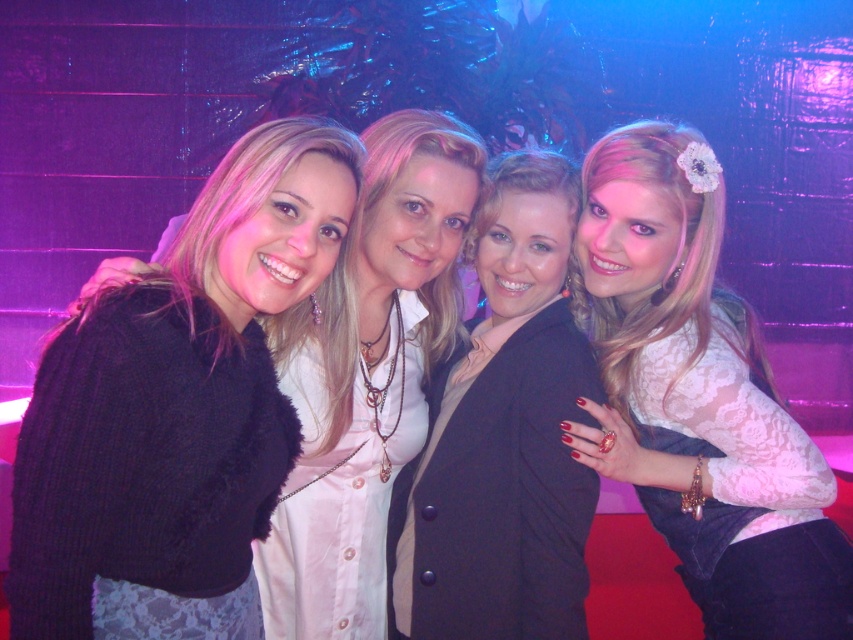
Between point (54, 634) and point (693, 541), which one is positioned in front?

Point (54, 634)

Is fuzzy black sweater at left bigger than lace fabric at upper right?

No.

At what (x,y) coordinates should I click in order to perform the action: click on fuzzy black sweater at left. Please return your answer as a coordinate pair (x, y). Image resolution: width=853 pixels, height=640 pixels. Looking at the image, I should click on (178, 406).

Can you confirm if fuzzy black sweater at left is bigger than matte black blazer at center?

Yes, fuzzy black sweater at left is bigger than matte black blazer at center.

Which is in front, point (134, 632) or point (451, 461)?

Point (134, 632) is in front.

Find the location of a particular element. The width and height of the screenshot is (853, 640). fuzzy black sweater at left is located at coordinates (178, 406).

Does point (735, 531) come closer to viewer compared to point (477, 554)?

No.

Who is more forward, (701, 140) or (392, 566)?

Point (701, 140) is in front.

Locate an element on the screen. The width and height of the screenshot is (853, 640). lace fabric at upper right is located at coordinates (699, 401).